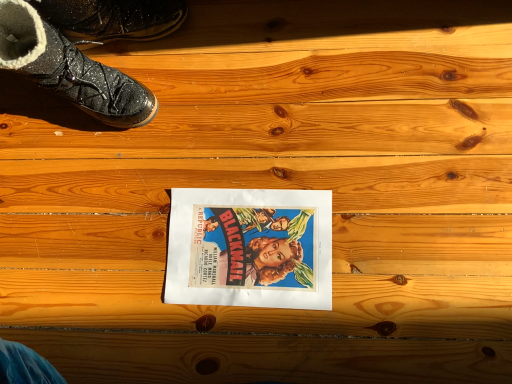
I want to click on blank space to the left of shiny black boot at upper left, the first footwear in the bottom-to-top sequence, so click(x=32, y=152).